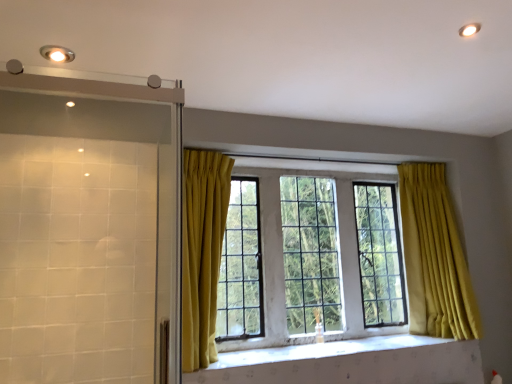
Where is `vacant space to the right of matte silver light fixture at upper left`? vacant space to the right of matte silver light fixture at upper left is located at coordinates (104, 52).